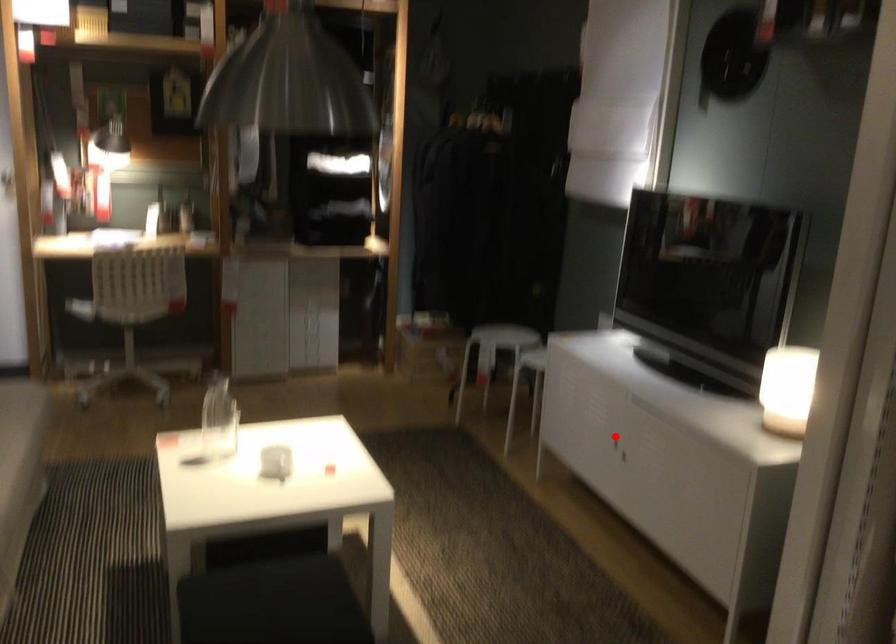
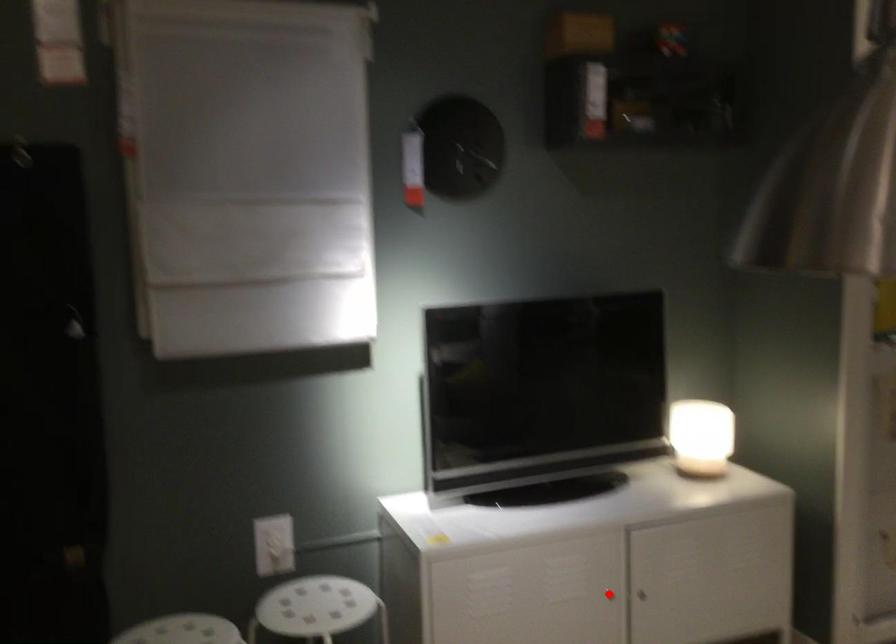
I am providing you with two images of the same scene from different viewpoints. A red point is marked on the first image and another point is marked on the second image. Are the points marked in image1 and image2 representing the same 3D position?

Yes